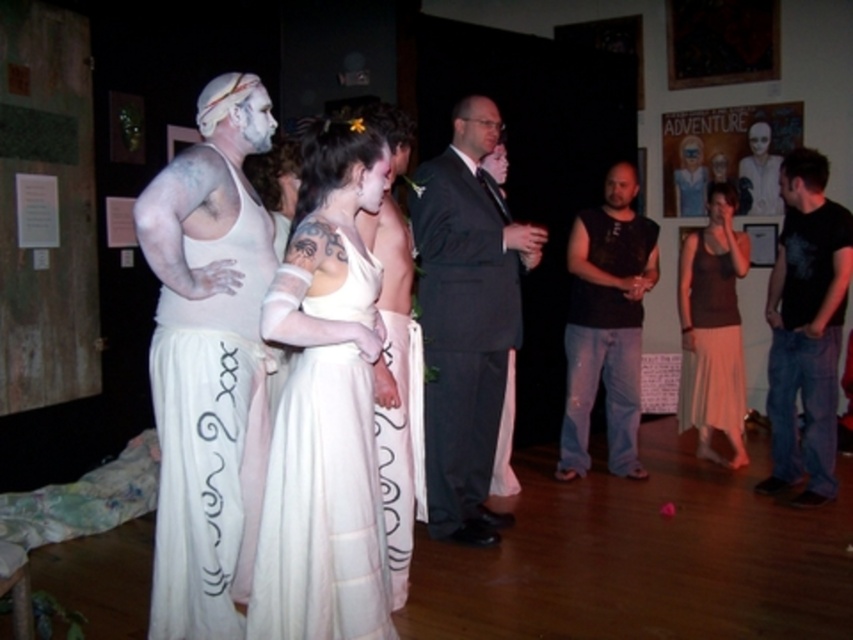
Question: Which object is positioned closest to the black sleeveless shirt at center?

Choices:
 (A) brown matte tank top at right
 (B) white matte mask at upper right

Answer: (A)

Question: Which is nearer to the white matte mask at upper right?

Choices:
 (A) white matte tank top at left
 (B) black sleeveless shirt at center
 (C) white silk skirt at center
 (D) dark gray suit at center

Answer: (B)

Question: Is black cotton t-shirt at right below black sleeveless shirt at center?

Choices:
 (A) no
 (B) yes

Answer: (B)

Question: Is the position of brown matte tank top at right more distant than that of white silk skirt at center?

Choices:
 (A) no
 (B) yes

Answer: (B)

Question: Among these objects, which one is nearest to the camera?

Choices:
 (A) black cotton t-shirt at right
 (B) white satin dress at center
 (C) white matte mask at upper right

Answer: (B)

Question: Is white matte tank top at left closer to the viewer compared to dark gray suit at center?

Choices:
 (A) yes
 (B) no

Answer: (A)